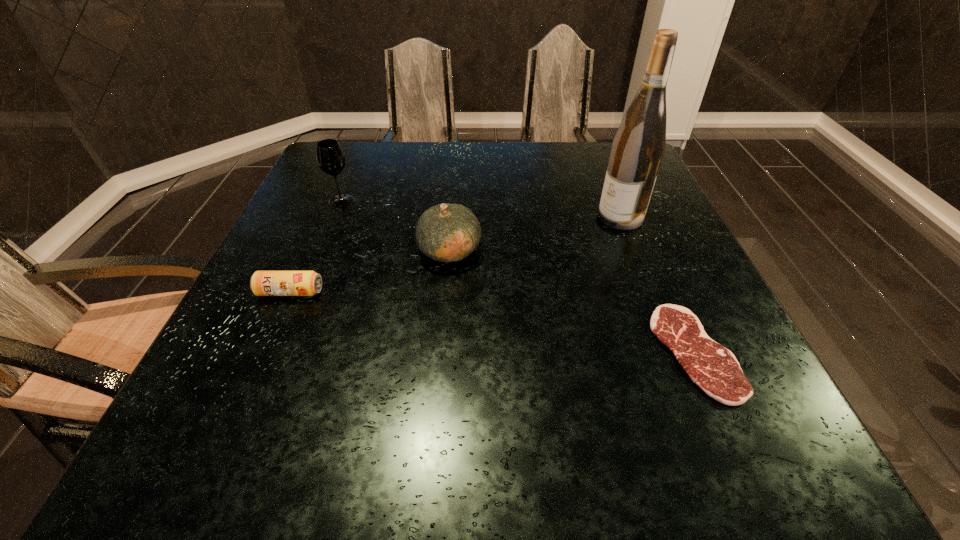
I want to click on free point at the far left corner, so click(x=350, y=163).

The width and height of the screenshot is (960, 540). What are the coordinates of `vacant space at the far right corner of the desktop` in the screenshot? It's located at (609, 146).

Where is `unoccupied position between the third farthest object and the steak`? unoccupied position between the third farthest object and the steak is located at coordinates (572, 301).

Identify the location of free area in between the nearest object and the fourth tallest object. Image resolution: width=960 pixels, height=540 pixels. (492, 322).

You are a GUI agent. You are given a task and a screenshot of the screen. Output one action in this format:
    pyautogui.click(x=<x>, y=<y>)
    Task: Click on the empty space between the wine bottle and the nearest object
    
    Given the screenshot: What is the action you would take?
    pyautogui.click(x=658, y=285)

Where is `free space that is in between the tallest object and the nearest object`? The width and height of the screenshot is (960, 540). free space that is in between the tallest object and the nearest object is located at coordinates (658, 285).

Where is `empty location between the shortest object and the second tallest object`? The width and height of the screenshot is (960, 540). empty location between the shortest object and the second tallest object is located at coordinates (517, 276).

At what (x,y) coordinates should I click in order to perform the action: click on vacant space that's between the shortest object and the tallest object. Please return your answer as a coordinate pair (x, y). Looking at the image, I should click on (658, 285).

I want to click on vacant area between the third tallest object and the wine bottle, so click(x=535, y=233).

What are the coordinates of `the second closest object to the fourth farthest object` in the screenshot? It's located at (330, 158).